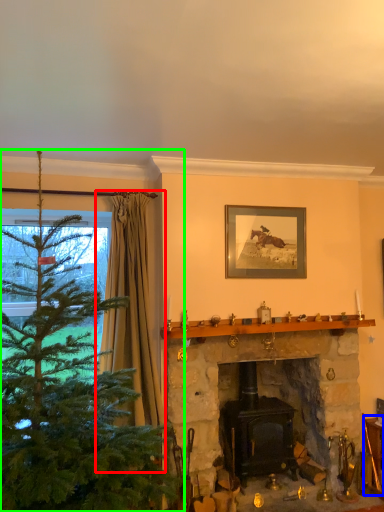
Question: Which object is positioned closest to curtain (highlighted by a red box)? Select from furniture (highlighted by a blue box) and christmas tree (highlighted by a green box).

Choices:
 (A) furniture
 (B) christmas tree

Answer: (B)